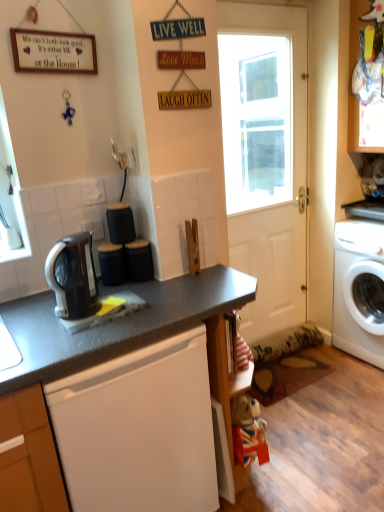
Question: Can you confirm if white matte door at center is smaller than white glossy washing machine at right?

Choices:
 (A) yes
 (B) no

Answer: (A)

Question: Is white matte door at center shorter than white glossy washing machine at right?

Choices:
 (A) yes
 (B) no

Answer: (B)

Question: From a real-world perspective, is white matte door at center on white glossy washing machine at right?

Choices:
 (A) yes
 (B) no

Answer: (A)

Question: From the image's perspective, is white matte door at center on top of white glossy washing machine at right?

Choices:
 (A) yes
 (B) no

Answer: (A)

Question: From a real-world perspective, is white matte door at center below white glossy washing machine at right?

Choices:
 (A) yes
 (B) no

Answer: (B)

Question: Is there a large distance between white matte door at center and white glossy washing machine at right?

Choices:
 (A) no
 (B) yes

Answer: (B)

Question: Does white matte door at center lie behind matte black countertop at center?

Choices:
 (A) no
 (B) yes

Answer: (B)

Question: Does white matte door at center have a greater height compared to matte black countertop at center?

Choices:
 (A) yes
 (B) no

Answer: (A)

Question: Can you confirm if white matte door at center is smaller than matte black countertop at center?

Choices:
 (A) no
 (B) yes

Answer: (B)

Question: Considering the relative sizes of white matte door at center and matte black countertop at center in the image provided, is white matte door at center shorter than matte black countertop at center?

Choices:
 (A) no
 (B) yes

Answer: (A)

Question: Is white matte door at center turned away from matte black countertop at center?

Choices:
 (A) yes
 (B) no

Answer: (B)

Question: Is white matte door at center with matte black countertop at center?

Choices:
 (A) no
 (B) yes

Answer: (A)

Question: From the image's perspective, would you say white glossy washing machine at right is positioned over black glossy coffee maker at left?

Choices:
 (A) yes
 (B) no

Answer: (B)